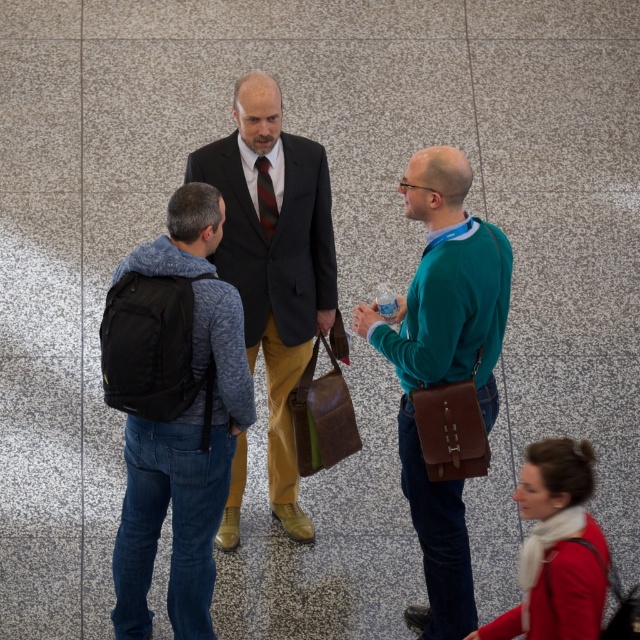
Question: In this image, where is teal leather briefcase at center located relative to matte black suit at center?

Choices:
 (A) above
 (B) below

Answer: (B)

Question: Does teal leather briefcase at center have a smaller size compared to matte black suit at center?

Choices:
 (A) no
 (B) yes

Answer: (A)

Question: Which point appears farthest from the camera in this image?

Choices:
 (A) (273, 225)
 (B) (451, 634)
 (C) (296, 358)

Answer: (C)

Question: Among these objects, which one is nearest to the camera?

Choices:
 (A) striped silk tie at center
 (B) teal leather briefcase at center
 (C) matte black suit at center

Answer: (B)

Question: Is teal leather briefcase at center bigger than striped silk tie at center?

Choices:
 (A) no
 (B) yes

Answer: (B)

Question: Which object is positioned farthest from the teal leather briefcase at center?

Choices:
 (A) striped silk tie at center
 (B) matte black suit at center

Answer: (A)